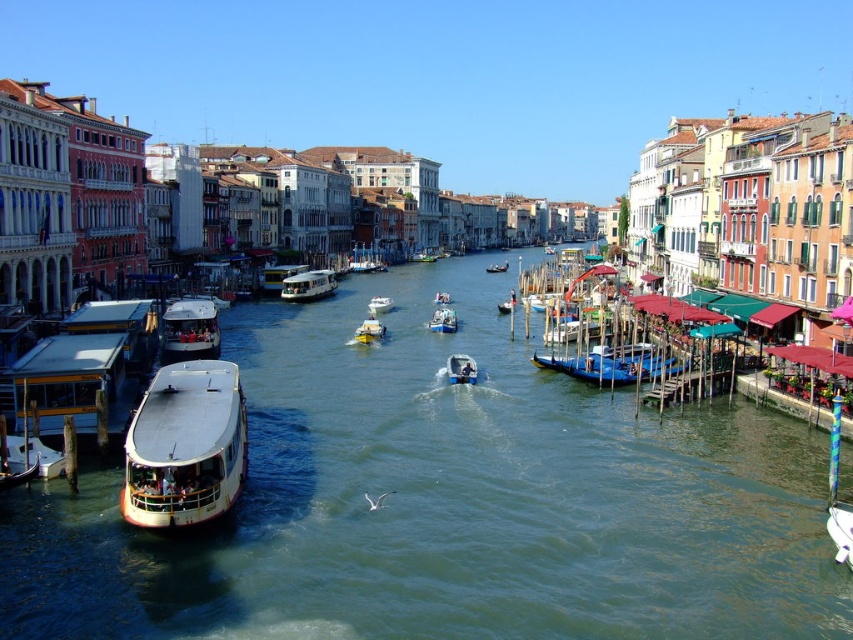
Is metallic silver gondola at center further to the viewer compared to white glossy motorboat at center?

No.

Can you confirm if metallic silver gondola at center is positioned to the left of white glossy motorboat at center?

In fact, metallic silver gondola at center is to the right of white glossy motorboat at center.

Does point (451, 372) lie in front of point (375, 314)?

Yes, it is.

Where is `metallic silver gondola at center`? Image resolution: width=853 pixels, height=640 pixels. metallic silver gondola at center is located at coordinates (461, 369).

Does white glossy boat at center-left have a lesser height compared to metallic gold boat at center?

No.

Between white glossy boat at center-left and metallic gold boat at center, which one is positioned lower?

Positioned lower is white glossy boat at center-left.

What do you see at coordinates (184, 445) in the screenshot?
I see `white glossy boat at center-left` at bounding box center [184, 445].

Find the location of a particular element. white glossy boat at center-left is located at coordinates (184, 445).

Where is `blue polished gondola at right`? blue polished gondola at right is located at coordinates (610, 364).

What do you see at coordinates (610, 364) in the screenshot? This screenshot has width=853, height=640. I see `blue polished gondola at right` at bounding box center [610, 364].

The image size is (853, 640). What do you see at coordinates (610, 364) in the screenshot? I see `blue polished gondola at right` at bounding box center [610, 364].

Identify the location of blue polished gondola at right. Image resolution: width=853 pixels, height=640 pixels. (610, 364).